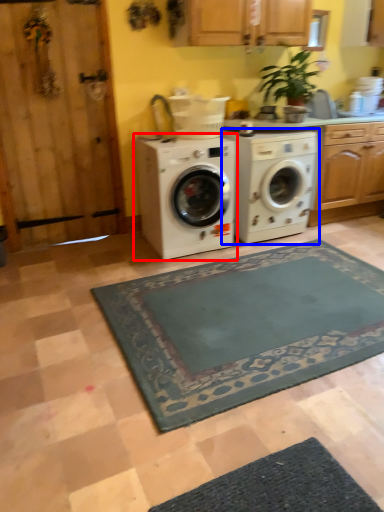
Question: Among these objects, which one is farthest to the camera, washing machine (highlighted by a red box) or washing machine (highlighted by a blue box)?

Choices:
 (A) washing machine
 (B) washing machine

Answer: (B)